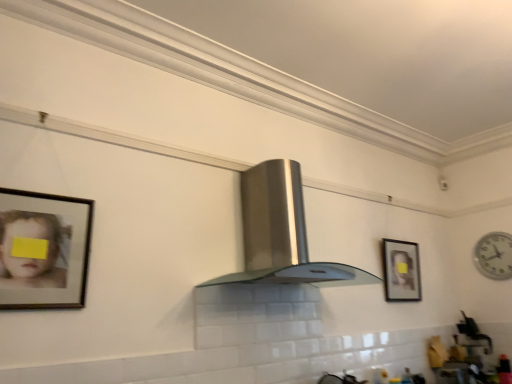
Question: Considering the relative positions of white plastic clock at right and stainless steel fume hood at center in the image provided, is white plastic clock at right to the left or to the right of stainless steel fume hood at center?

Choices:
 (A) right
 (B) left

Answer: (A)

Question: From the image's perspective, is white plastic clock at right positioned above or below stainless steel fume hood at center?

Choices:
 (A) below
 (B) above

Answer: (A)

Question: Which is nearer to the stainless steel fume hood at center?

Choices:
 (A) wooden framed portrait at center right, placed as the 1th picture frame when sorted from back to front
 (B) wooden framed portrait at left, the first picture frame viewed from the front
 (C) white plastic clock at right
 (D) white glossy sink at lower right

Answer: (A)

Question: Estimate the real-world distances between objects in this image. Which object is farther from the wooden framed portrait at center right, placed as the 1th picture frame when sorted from back to front?

Choices:
 (A) stainless steel fume hood at center
 (B) white plastic clock at right
 (C) wooden framed portrait at left, positioned as the first picture frame in left-to-right order
 (D) white glossy sink at lower right

Answer: (C)